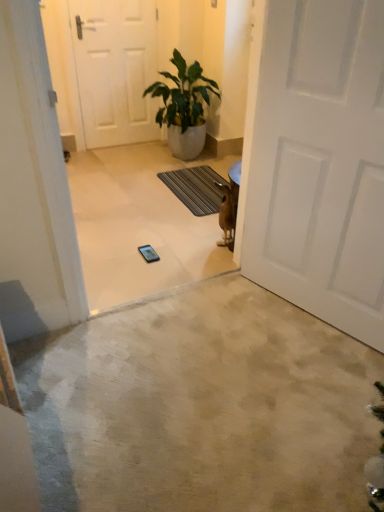
This screenshot has width=384, height=512. What are the coordinates of `free space in front of white matte door at upper center, marked as the first door in a back-to-front arrangement` in the screenshot? It's located at (109, 158).